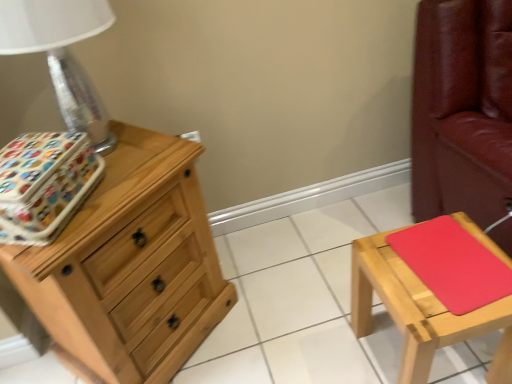
Where is `vacant space underneath red matte pad at right (from a real-world perspective)`? The image size is (512, 384). vacant space underneath red matte pad at right (from a real-world perspective) is located at coordinates (451, 260).